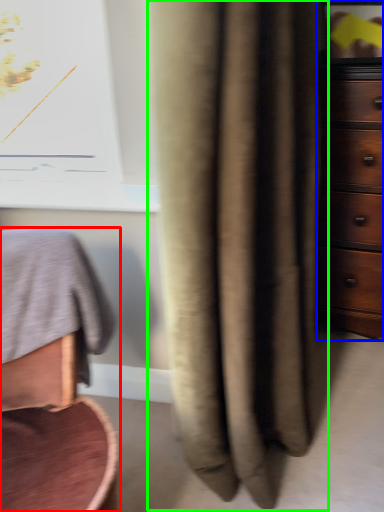
Question: Which object is positioned farthest from furniture (highlighted by a red box)? Select from chest of drawers (highlighted by a blue box) and curtain (highlighted by a green box).

Choices:
 (A) chest of drawers
 (B) curtain

Answer: (A)